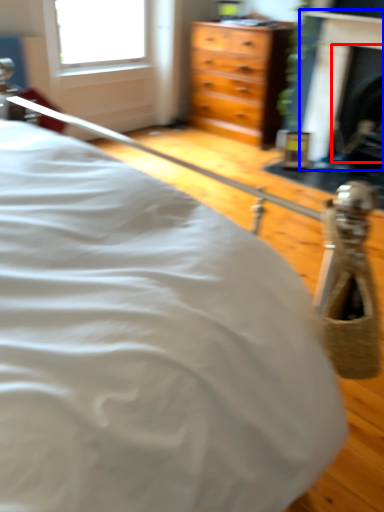
Question: Which object is closer to the camera taking this photo, fireplace (highlighted by a red box) or fireplace (highlighted by a blue box)?

Choices:
 (A) fireplace
 (B) fireplace

Answer: (B)